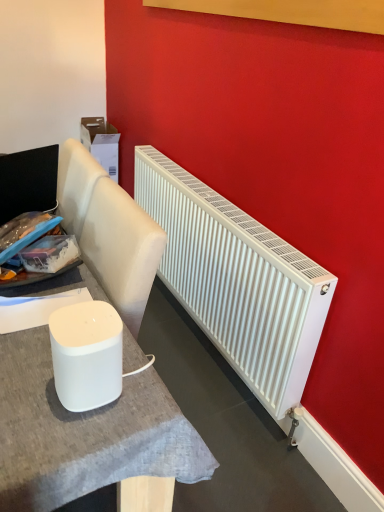
Question: Is white matte speaker at lower left further to camera compared to white matte radiator at right?

Choices:
 (A) yes
 (B) no

Answer: (B)

Question: Can you confirm if white matte speaker at lower left is smaller than white matte radiator at right?

Choices:
 (A) yes
 (B) no

Answer: (A)

Question: Does white matte speaker at lower left have a lesser height compared to white matte radiator at right?

Choices:
 (A) yes
 (B) no

Answer: (A)

Question: From the image's perspective, is white matte speaker at lower left on top of white matte radiator at right?

Choices:
 (A) yes
 (B) no

Answer: (B)

Question: Is white matte speaker at lower left facing away from white matte radiator at right?

Choices:
 (A) yes
 (B) no

Answer: (B)

Question: Looking at the image, does white matte speaker at lower left seem bigger or smaller compared to white matte radiator at right?

Choices:
 (A) small
 (B) big

Answer: (A)

Question: From the image's perspective, is white matte speaker at lower left positioned above or below white matte radiator at right?

Choices:
 (A) above
 (B) below

Answer: (B)

Question: Choose the correct answer: Is white matte speaker at lower left inside white matte radiator at right or outside it?

Choices:
 (A) inside
 (B) outside

Answer: (B)

Question: From a real-world perspective, is white matte speaker at lower left above or below white matte radiator at right?

Choices:
 (A) below
 (B) above

Answer: (B)

Question: In terms of size, does white matte table at center appear bigger or smaller than white matte speaker at lower left?

Choices:
 (A) small
 (B) big

Answer: (B)

Question: From a real-world perspective, is white matte table at center positioned above or below white matte speaker at lower left?

Choices:
 (A) below
 (B) above

Answer: (A)

Question: In terms of width, does white matte table at center look wider or thinner when compared to white matte speaker at lower left?

Choices:
 (A) wide
 (B) thin

Answer: (A)

Question: Is white matte table at center inside the boundaries of white matte speaker at lower left, or outside?

Choices:
 (A) outside
 (B) inside

Answer: (A)

Question: From a real-world perspective, relative to white matte table at center, is white matte radiator at right vertically above or below?

Choices:
 (A) below
 (B) above

Answer: (B)

Question: In terms of height, does white matte radiator at right look taller or shorter compared to white matte table at center?

Choices:
 (A) tall
 (B) short

Answer: (B)